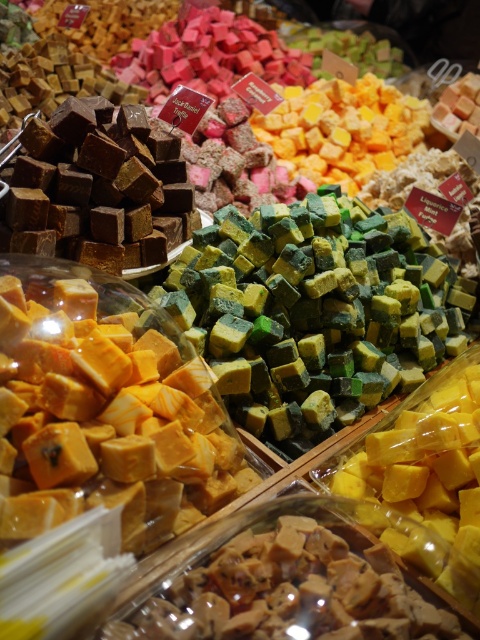
Locate an element on the screen. This screenshot has height=640, width=480. green matte fudge at center is located at coordinates (312, 314).

Is green matte fudge at center smaller than matte brown fudge at center?

No, green matte fudge at center is not smaller than matte brown fudge at center.

Between point (323, 321) and point (324, 563), which one is positioned in front?

Point (324, 563) is in front.

I want to click on green matte fudge at center, so click(312, 314).